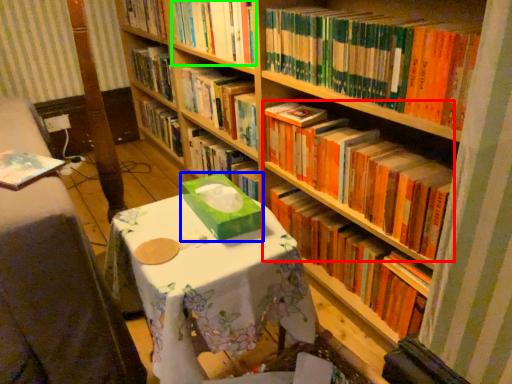
Question: Which object is positioned farthest from book (highlighted by a red box)? Select from cardboard box (highlighted by a blue box) and book (highlighted by a green box).

Choices:
 (A) cardboard box
 (B) book

Answer: (B)